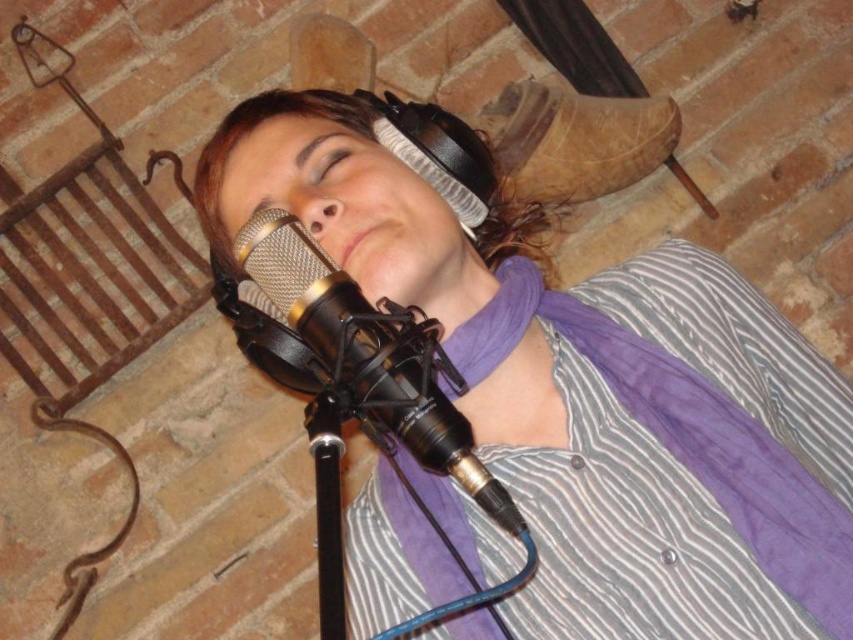
Between matte black headphones at center and black metallic microphone at center, which one appears on the right side from the viewer's perspective?

From the viewer's perspective, matte black headphones at center appears more on the right side.

Between point (775, 502) and point (424, 397), which one is positioned in front?

Point (424, 397)

Is point (733, 589) more distant than point (268, 352)?

No.

Where is `matte black headphones at center`? The width and height of the screenshot is (853, 640). matte black headphones at center is located at coordinates (589, 392).